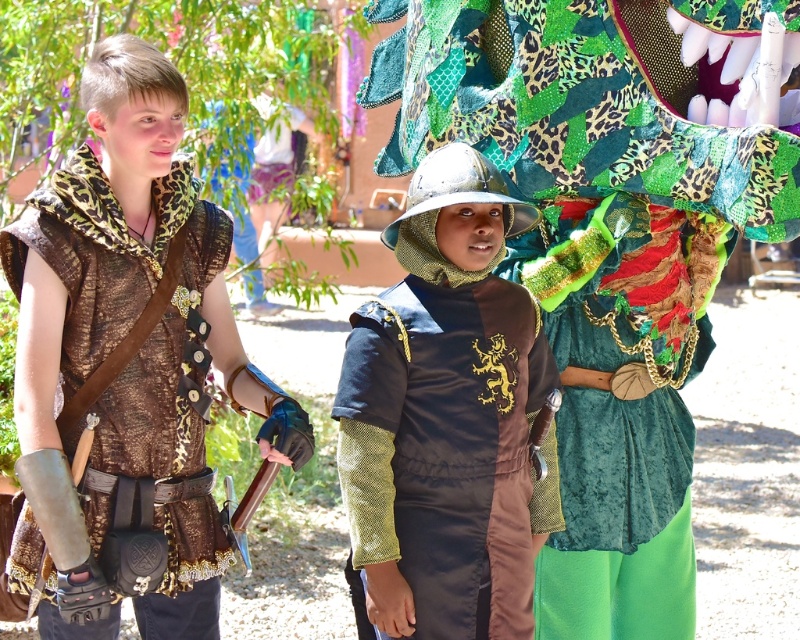
You are standing at the camera position and want to throw a ball to hit the point at coordinates point (566, 538). If the maximum distance you can throw is 12 meters, will you be able to reach that point?

The point at coordinates point (566, 538) is 12.65 meters away from the camera, which exceeds your throwing distance of 12 meters. Therefore, you cannot reach it.

You are standing at the origin point of the image. Which object is located at the coordinates point [602,236]?

The velvet green dragon head at center is located at the coordinates point [602,236].

You are standing in the outdoor scene with two points marked. The first point is at coordinates point (x=664, y=221) and the second is at point (x=520, y=413). Which point is closer to you?

Point (x=664, y=221) is closer to you because it is further to the viewer than point (x=520, y=413).